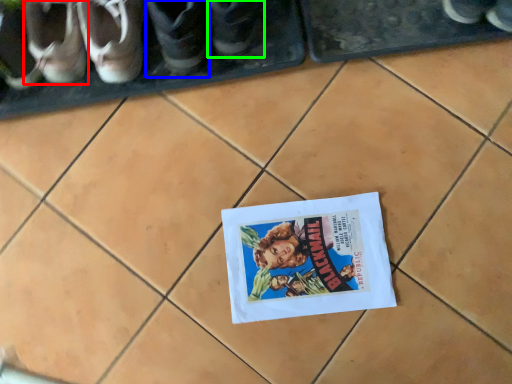
Question: Which object is the farthest from footwear (highlighted by a red box)? Choose among these: footwear (highlighted by a blue box) or footwear (highlighted by a green box).

Choices:
 (A) footwear
 (B) footwear

Answer: (B)